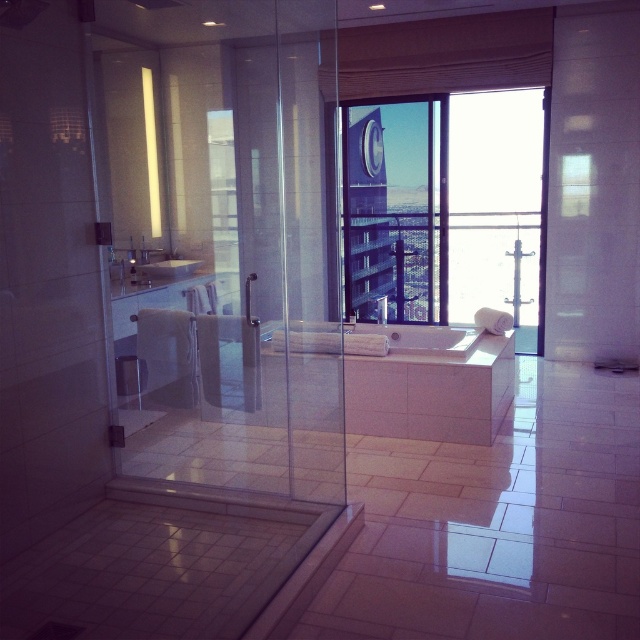
You are a home inspector evaluating the bathroom layout. You need to determine if the transparent glass screen door at left can be replaced with a standard shower curtain without altering the white glossy sink at center. What should you consider regarding their sizes?

The transparent glass screen door at left is taller than the white glossy sink at center. Since the door is taller, replacing it with a standard shower curtain might require ensuring the curtain is long enough to cover the height of the door area without interfering with the sink.

You are standing in the bathroom and want to look outside through the transparent glass window at center. However, the white glossy sink at center is blocking your view. Can you see the entire window from your current position?

The transparent glass window at center has a greater height compared to white glossy sink at center, so you can see the entire window as the sink does not obstruct its full height.